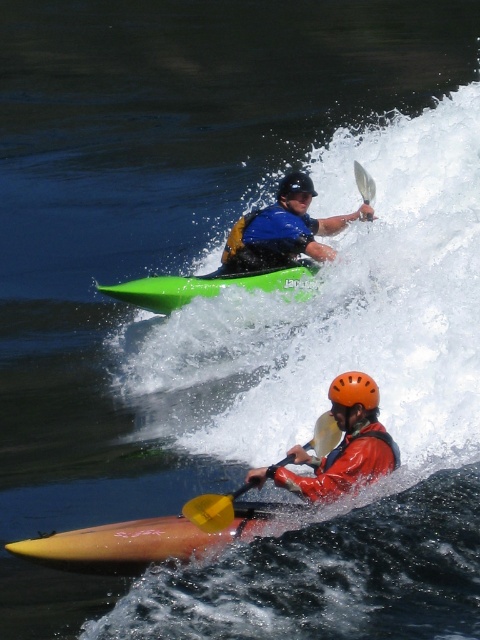
Does matte blue kayak at center appear on the left side of green matte kayak at upper center?

In fact, matte blue kayak at center is to the right of green matte kayak at upper center.

Is matte blue kayak at center positioned in front of green matte kayak at upper center?

No, it is behind green matte kayak at upper center.

Between point (364, 202) and point (267, 284), which one is positioned behind?

Point (364, 202)

At what (x,y) coordinates should I click in order to perform the action: click on matte blue kayak at center. Please return your answer as a coordinate pair (x, y). Looking at the image, I should click on (288, 227).

Who is positioned more to the left, black matte helmet at upper center or white plastic paddle at upper center?

Positioned to the left is black matte helmet at upper center.

Which is below, black matte helmet at upper center or white plastic paddle at upper center?

white plastic paddle at upper center is below.

Is point (305, 177) positioned behind point (357, 161)?

No.

Locate an element on the screen. Image resolution: width=480 pixels, height=640 pixels. black matte helmet at upper center is located at coordinates (295, 186).

Can you confirm if orange matte helmet at center is taller than black matte helmet at upper center?

No, orange matte helmet at center is not taller than black matte helmet at upper center.

Can you confirm if orange matte helmet at center is wider than black matte helmet at upper center?

Yes.

Measure the distance between point (317, 477) and camera.

Point (317, 477) and camera are 7.30 meters apart from each other.

Identify the location of orange matte helmet at center. (342, 445).